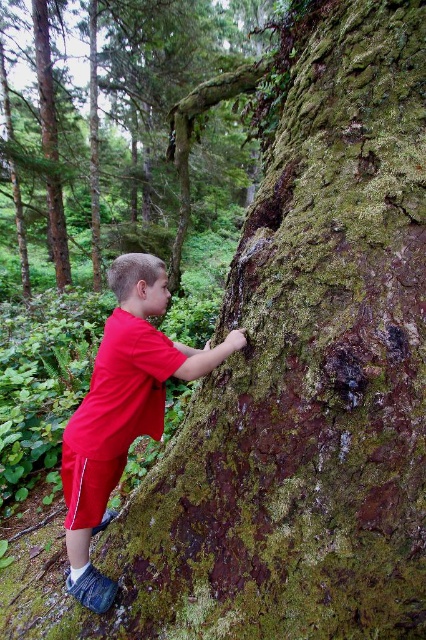
Is point (247, 74) positioned after point (132, 424)?

That is True.

Is point (23, 48) more distant than point (106, 428)?

Yes, point (23, 48) is farther from viewer.

Where is `green mossy tree trunk at center`? green mossy tree trunk at center is located at coordinates (172, 115).